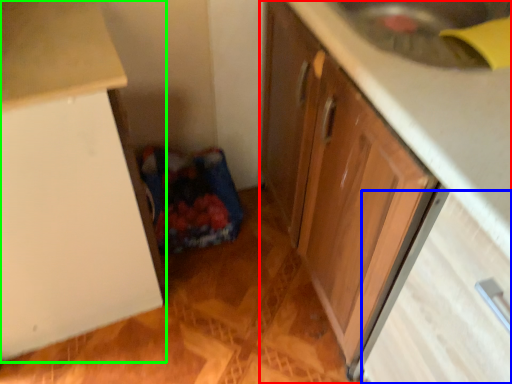
Question: Which object is positioned farthest from cabinetry (highlighted by a red box)? Select from drawer (highlighted by a blue box) and cabinetry (highlighted by a green box).

Choices:
 (A) drawer
 (B) cabinetry

Answer: (B)